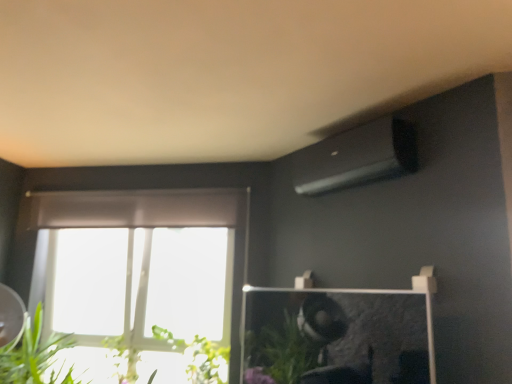
Question: Does green leafy plant at lower left, which is counted as the 2th plant, starting from the right, have a lesser height compared to green leafy plant at lower left?

Choices:
 (A) yes
 (B) no

Answer: (A)

Question: Is green leafy plant at lower left a part of green leafy plant at lower left, which is counted as the 2th plant, starting from the right?

Choices:
 (A) no
 (B) yes

Answer: (A)

Question: From a real-world perspective, is green leafy plant at lower left, which ranks as the first plant in left-to-right order, positioned over green leafy plant at lower left based on gravity?

Choices:
 (A) yes
 (B) no

Answer: (B)

Question: Does green leafy plant at lower left, which ranks as the first plant in left-to-right order, have a greater width compared to green leafy plant at lower left?

Choices:
 (A) yes
 (B) no

Answer: (B)

Question: From the image's perspective, does green leafy plant at lower left, which ranks as the first plant in left-to-right order, appear lower than green leafy plant at lower left?

Choices:
 (A) no
 (B) yes

Answer: (B)

Question: Does green leafy plant at lower left, which is counted as the 2th plant, starting from the right, come behind green leafy plant at lower left?

Choices:
 (A) yes
 (B) no

Answer: (A)

Question: Does green leafy plant at lower left have a greater width compared to green leafy plant at lower left, placed as the 1th plant when sorted from right to left?

Choices:
 (A) yes
 (B) no

Answer: (A)

Question: Is green leafy plant at lower left bigger than green leafy plant at lower left, placed as the 1th plant when sorted from right to left?

Choices:
 (A) yes
 (B) no

Answer: (A)

Question: Is green leafy plant at lower left next to green leafy plant at lower left, placed as the 1th plant when sorted from right to left, and touching it?

Choices:
 (A) no
 (B) yes

Answer: (A)

Question: Is green leafy plant at lower left not within green leafy plant at lower left, the second plant viewed from the left?

Choices:
 (A) yes
 (B) no

Answer: (A)

Question: Can you confirm if green leafy plant at lower left is smaller than green leafy plant at lower left, the second plant viewed from the left?

Choices:
 (A) no
 (B) yes

Answer: (A)

Question: Can you confirm if green leafy plant at lower left is thinner than green leafy plant at lower left, the second plant viewed from the left?

Choices:
 (A) no
 (B) yes

Answer: (A)

Question: Does green leafy plant at lower left, placed as the 1th plant when sorted from right to left, have a greater width compared to green leafy plant at lower left?

Choices:
 (A) yes
 (B) no

Answer: (B)